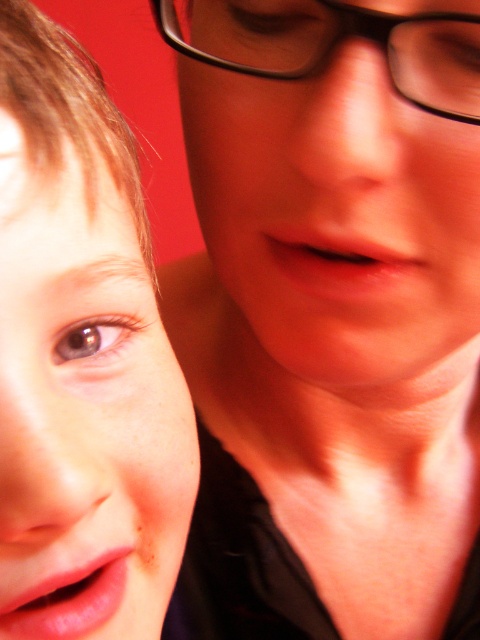
Question: Which of the following is the farthest from the observer?

Choices:
 (A) smooth skin face at left
 (B) black plastic glasses at upper center

Answer: (B)

Question: Does smooth skin face at left appear on the left side of black plastic glasses at upper center?

Choices:
 (A) no
 (B) yes

Answer: (B)

Question: Among these points, which one is nearest to the camera?

Choices:
 (A) (260, 8)
 (B) (16, 70)

Answer: (B)

Question: Can you confirm if smooth skin face at left is positioned below black plastic glasses at upper center?

Choices:
 (A) no
 (B) yes

Answer: (B)

Question: Which object appears farthest from the camera in this image?

Choices:
 (A) black plastic glasses at upper center
 (B) smooth skin face at left

Answer: (A)

Question: Is smooth skin face at left above black plastic glasses at upper center?

Choices:
 (A) no
 (B) yes

Answer: (A)